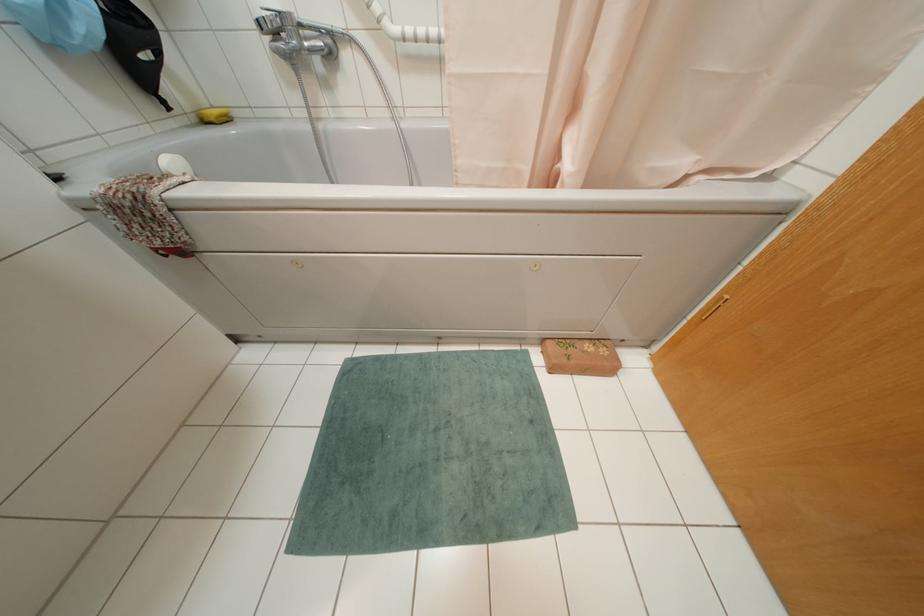
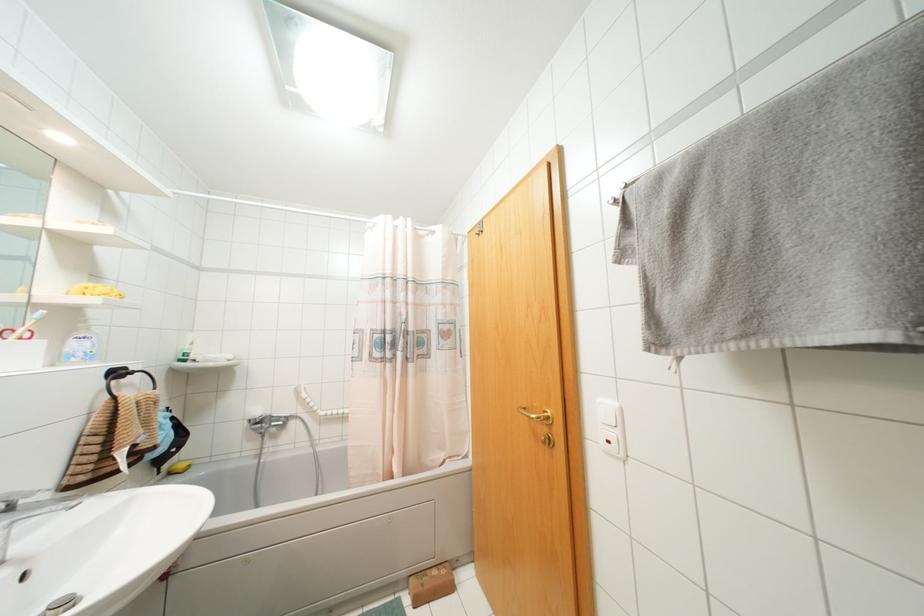
Where in the second image is the point corresponding to pixel 202 121 from the first image?

(169, 472)